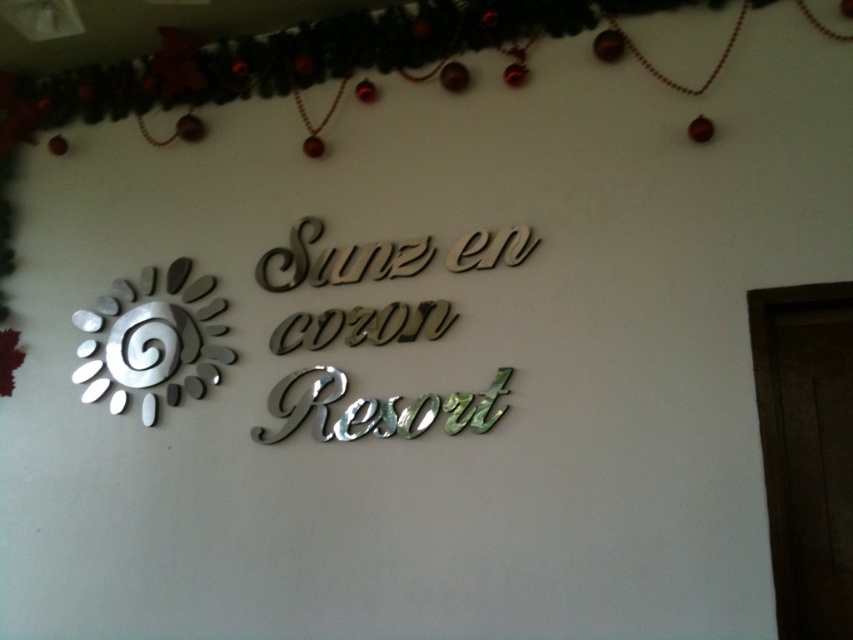
Question: Does silver/metallic sign at center have a lesser width compared to silver metallic sun at left?

Choices:
 (A) yes
 (B) no

Answer: (B)

Question: Among these points, which one is nearest to the camera?

Choices:
 (A) [428, 237]
 (B) [143, 390]

Answer: (A)

Question: Does silver/metallic sign at center have a larger size compared to silver metallic sun at left?

Choices:
 (A) yes
 (B) no

Answer: (A)

Question: Considering the relative positions of silver/metallic sign at center and silver metallic sun at left in the image provided, where is silver/metallic sign at center located with respect to silver metallic sun at left?

Choices:
 (A) left
 (B) right

Answer: (B)

Question: Which object is closer to the camera taking this photo?

Choices:
 (A) silver/metallic sign at center
 (B) silver metallic sun at left

Answer: (A)

Question: Among these objects, which one is farthest from the camera?

Choices:
 (A) silver/metallic sign at center
 (B) silver metallic sun at left

Answer: (B)